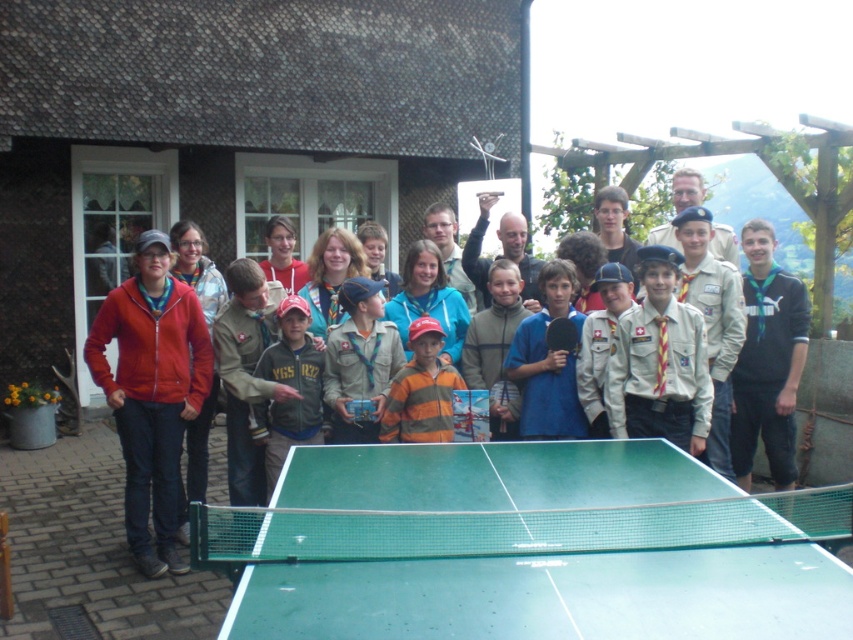
Question: Can you confirm if brown wooden hut at center is thinner than green plastic table tennis table at center?

Choices:
 (A) no
 (B) yes

Answer: (A)

Question: Which of the following is the farthest from the observer?

Choices:
 (A) khaki uniform at center
 (B) brown wooden hut at center

Answer: (B)

Question: Which object appears closest to the camera in this image?

Choices:
 (A) matte red jacket at left
 (B) dark gray fleece jacket at center

Answer: (A)

Question: Can you confirm if matte khaki uniform at center is thinner than green rubber table tennis at center?

Choices:
 (A) yes
 (B) no

Answer: (B)

Question: Among these objects, which one is nearest to the camera?

Choices:
 (A) green plastic table tennis table at center
 (B) dark gray fleece jacket at center

Answer: (A)

Question: Is blue fabric shirt at center below green rubber table tennis at center?

Choices:
 (A) yes
 (B) no

Answer: (B)